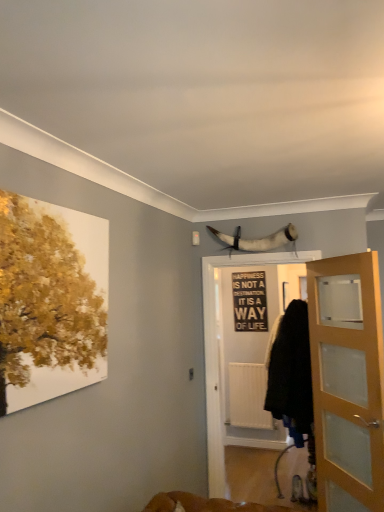
Identify the location of light brown wooden door at right. point(347,381).

Measure the distance between white matte radiator at center and camera.

The distance of white matte radiator at center from camera is 5.22 meters.

This screenshot has height=512, width=384. What do you see at coordinates (250, 301) in the screenshot? I see `black matte signboard at center` at bounding box center [250, 301].

What do you see at coordinates (257, 239) in the screenshot? The image size is (384, 512). I see `white horn at upper center` at bounding box center [257, 239].

Where is `light brown wooden door at right`? light brown wooden door at right is located at coordinates (347, 381).

Looking at this image, does light brown wooden door at right come in front of white horn at upper center?

Yes, light brown wooden door at right is in front of white horn at upper center.

How different are the orientations of light brown wooden door at right and white horn at upper center in degrees?

light brown wooden door at right and white horn at upper center are facing 55.5 degrees away from each other.

Considering the relative sizes of light brown wooden door at right and white horn at upper center in the image provided, is light brown wooden door at right thinner than white horn at upper center?

Yes.

From the image's perspective, which is below, light brown wooden door at right or white horn at upper center?

light brown wooden door at right appears lower in the image.

Which object is positioned more to the right, white horn at upper center or light brown wooden door at right?

Positioned to the right is light brown wooden door at right.

In terms of height, does white horn at upper center look taller or shorter compared to light brown wooden door at right?

In the image, white horn at upper center appears to be shorter than light brown wooden door at right.

Considering the points (292, 225) and (335, 510), which point is behind, point (292, 225) or point (335, 510)?

The point (292, 225) is farther from the camera.

Based on the photo, is white horn at upper center in front of light brown wooden door at right?

No, the depth of white horn at upper center is greater than that of light brown wooden door at right.

From a real-world perspective, between black matte signboard at center and light brown wooden door at right, who is vertically higher?

black matte signboard at center, from a real-world perspective.

Is black matte signboard at center bigger or smaller than light brown wooden door at right?

black matte signboard at center is smaller than light brown wooden door at right.

This screenshot has width=384, height=512. I want to click on bulletin board above the light brown wooden door at right (from the image's perspective), so click(x=250, y=301).

How far apart are white horn at upper center and black matte signboard at center?

A distance of 1.88 meters exists between white horn at upper center and black matte signboard at center.

Does white horn at upper center lie behind black matte signboard at center?

No, white horn at upper center is closer to the camera.

Are white horn at upper center and black matte signboard at center far apart?

white horn at upper center is positioned a significant distance from black matte signboard at center.

Is black fabric screen door at center outside of white matte radiator at center?

black fabric screen door at center lies outside white matte radiator at center's area.

Between point (212, 379) and point (258, 362), which one is positioned behind?

The point (258, 362) is farther.

From the image's perspective, is black fabric screen door at center located above or below white matte radiator at center?

black fabric screen door at center is situated higher than white matte radiator at center in the image.

Is white matte radiator at center wider than black matte signboard at center?

Correct, the width of white matte radiator at center exceeds that of black matte signboard at center.

From the image's perspective, is white matte radiator at center positioned above or below black matte signboard at center?

white matte radiator at center is below black matte signboard at center.

Which is in front, point (377, 298) or point (255, 393)?

The point (377, 298) is closer.

From the image's perspective, would you say light brown wooden door at right is shown under white matte radiator at center?

No.

In the scene shown: Considering the relative positions of light brown wooden door at right and white matte radiator at center in the image provided, is light brown wooden door at right behind white matte radiator at center?

No.

Is light brown wooden door at right taller than white matte radiator at center?

Yes, light brown wooden door at right is taller than white matte radiator at center.

Where is `door below the white horn at upper center (from the image's perspective)`? The image size is (384, 512). door below the white horn at upper center (from the image's perspective) is located at coordinates (347, 381).

Locate an element on the screen. The height and width of the screenshot is (512, 384). animal above the light brown wooden door at right (from a real-world perspective) is located at coordinates (257, 239).

When comparing their distances from white matte radiator at center, does light brown wooden door at right or black fabric screen door at center seem further?

light brown wooden door at right is further to white matte radiator at center.

Based on the photo, when comparing their distances from white horn at upper center, does black fabric screen door at center or white matte radiator at center seem further?

Based on the image, white matte radiator at center appears to be further to white horn at upper center.

From the image, which object appears to be farther from black matte signboard at center, light brown wooden door at right or black fabric screen door at center?

The object further to black matte signboard at center is light brown wooden door at right.

Which object lies nearer to the anchor point white horn at upper center, white matte radiator at center or black matte signboard at center?

black matte signboard at center is positioned closer to the anchor white horn at upper center.

When comparing their distances from light brown wooden door at right, does black fabric screen door at center or white matte radiator at center seem closer?

The object closer to light brown wooden door at right is black fabric screen door at center.

Which object lies nearer to the anchor point black fabric screen door at center, white horn at upper center or light brown wooden door at right?

white horn at upper center.

When comparing their distances from white horn at upper center, does white matte radiator at center or light brown wooden door at right seem further?

white matte radiator at center is further to white horn at upper center.

Considering their positions, is black fabric screen door at center positioned further to black matte signboard at center than light brown wooden door at right?

Among the two, light brown wooden door at right is located further to black matte signboard at center.

Find the location of `animal located between black fabric screen door at center and black matte signboard at center in the depth direction`. animal located between black fabric screen door at center and black matte signboard at center in the depth direction is located at coordinates (257, 239).

Find the location of a particular element. radiator between black fabric screen door at center and black matte signboard at center from front to back is located at coordinates (248, 396).

Find the location of a particular element. The height and width of the screenshot is (512, 384). screen door between light brown wooden door at right and black matte signboard at center from front to back is located at coordinates (217, 352).

The image size is (384, 512). I want to click on animal between light brown wooden door at right and white matte radiator at center along the z-axis, so coord(257,239).